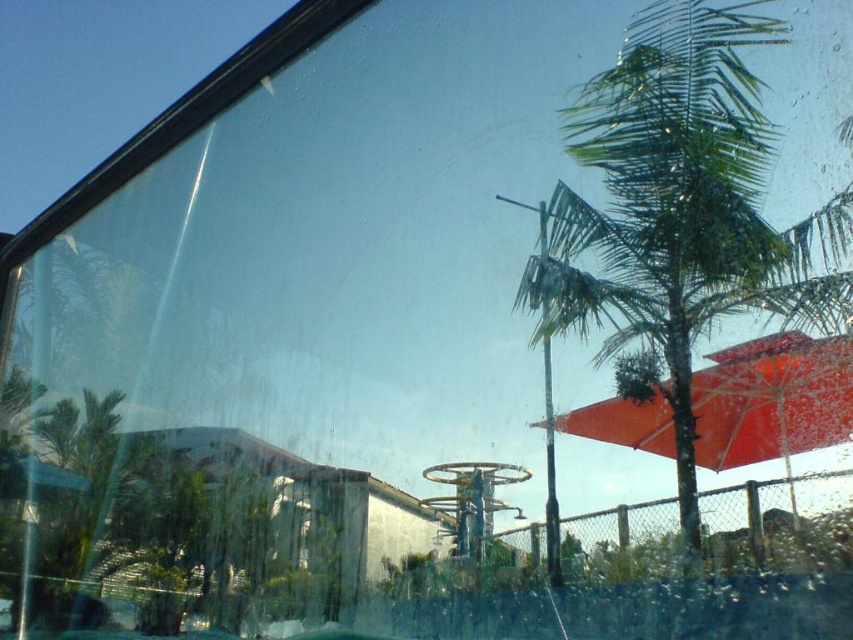
Based on the photo, based on the scene description, where is the green leafy palm tree at right located in terms of its 2D coordinates?

The green leafy palm tree at right is located at the 2D coordinates of point (x=665, y=205).

You are a guest at a resort and looking through the car window. You see a green leafy palm tree at right and a matte red umbrella at center right. Which object is higher in the image?

The green leafy palm tree at right is positioned over the matte red umbrella at center right, so it is higher in the image.